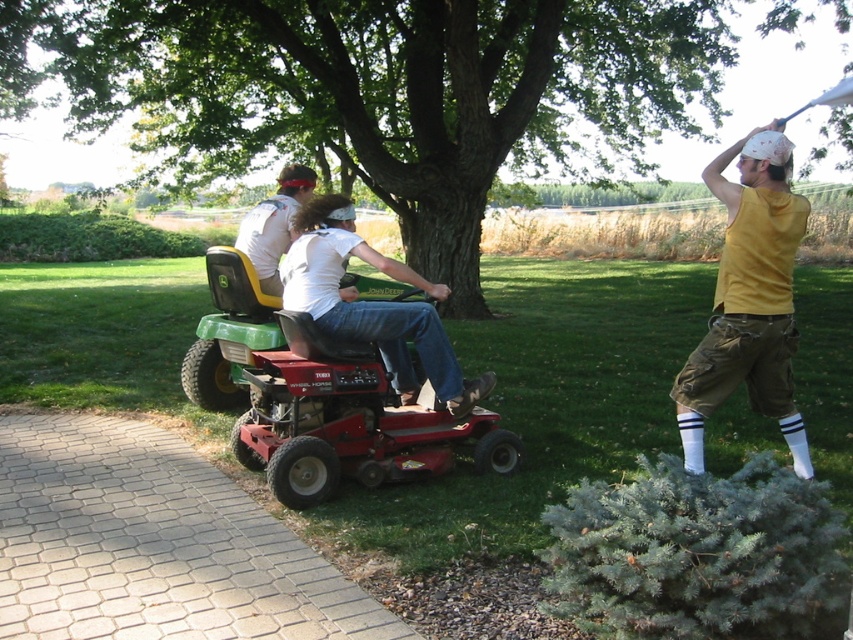
Does green plastic lawn mower at center have a greater height compared to yellow sleeveless shirt at right?

No.

Is green plastic lawn mower at center thinner than yellow sleeveless shirt at right?

Indeed, green plastic lawn mower at center has a lesser width compared to yellow sleeveless shirt at right.

Is point (229, 280) positioned before point (762, 168)?

No, (229, 280) is further to viewer.

Locate an element on the screen. The height and width of the screenshot is (640, 853). green plastic lawn mower at center is located at coordinates [x=318, y=397].

Does green plastic lawn mower at center have a smaller size compared to matte red lawn mower at center?

Actually, green plastic lawn mower at center might be larger than matte red lawn mower at center.

Between point (370, 417) and point (318, 262), which one is positioned in front?

Positioned in front is point (370, 417).

Is point (286, 465) more distant than point (294, 248)?

No, it is in front of (294, 248).

What are the coordinates of `green plastic lawn mower at center` in the screenshot? It's located at (318, 397).

Between point (248, 323) and point (286, 236), which one is positioned behind?

Positioned behind is point (286, 236).

Does green plastic lawn mower at center have a greater width compared to matte white shirt at center?

Correct, the width of green plastic lawn mower at center exceeds that of matte white shirt at center.

Is point (259, 291) more distant than point (260, 224)?

No.

In order to click on green plastic lawn mower at center in this screenshot , I will do `click(318, 397)`.